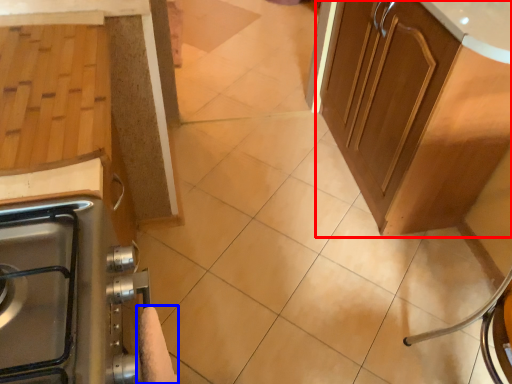
Question: Among these objects, which one is nearest to the camera, cabinetry (highlighted by a red box) or hand towel (highlighted by a blue box)?

Choices:
 (A) cabinetry
 (B) hand towel

Answer: (B)